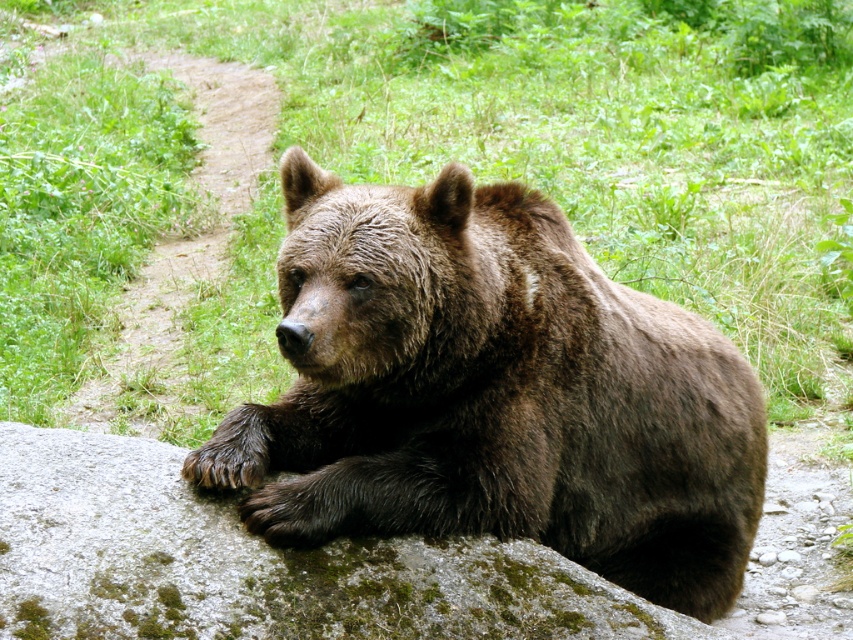
Does brown furry bear at center appear over green mossy rock at center?

Yes, brown furry bear at center is above green mossy rock at center.

Identify the location of brown furry bear at center. [492, 392].

You are a GUI agent. You are given a task and a screenshot of the screen. Output one action in this format:
    pyautogui.click(x=<x>, y=<y>)
    Task: Click on the brown furry bear at center
    The width and height of the screenshot is (853, 640).
    Given the screenshot: What is the action you would take?
    pyautogui.click(x=492, y=392)